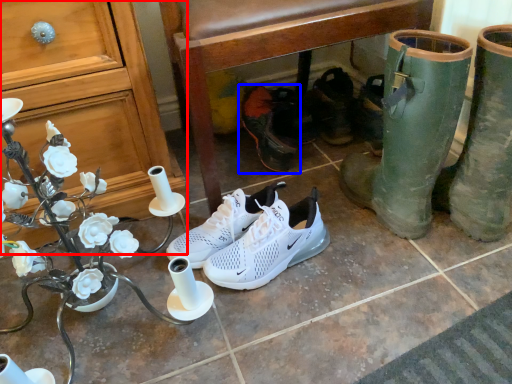
Question: Which object is further to the camera taking this photo, cabinetry (highlighted by a red box) or footwear (highlighted by a blue box)?

Choices:
 (A) cabinetry
 (B) footwear

Answer: (B)